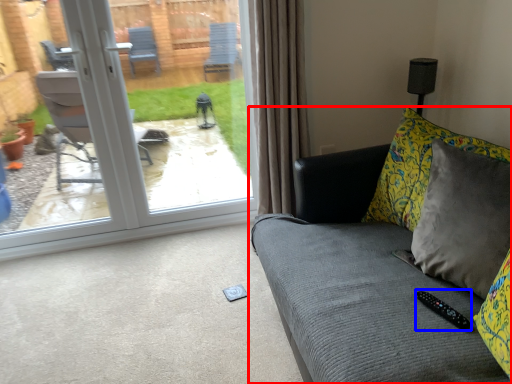
Question: Which point is further to the camera, studio couch (highlighted by a red box) or remote (highlighted by a blue box)?

Choices:
 (A) studio couch
 (B) remote

Answer: (B)